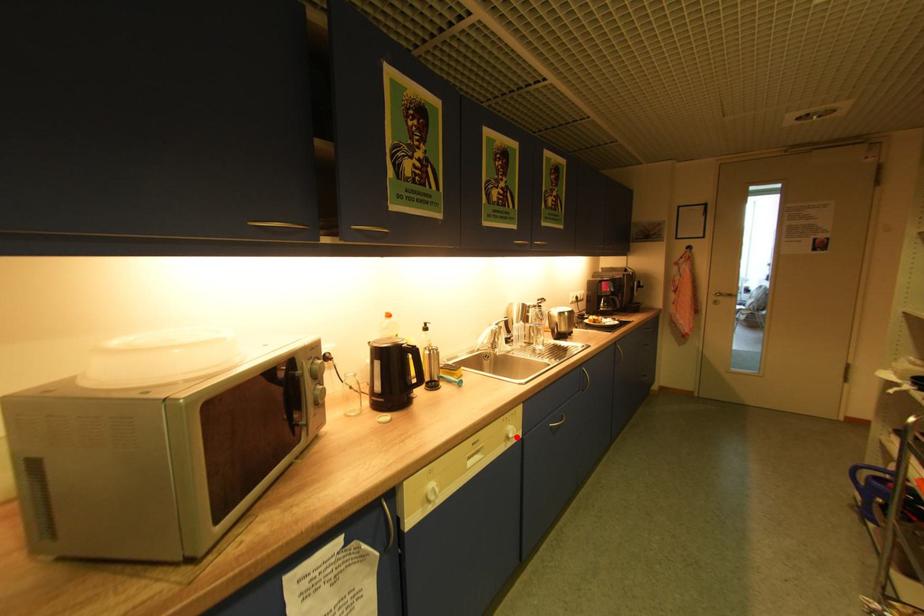
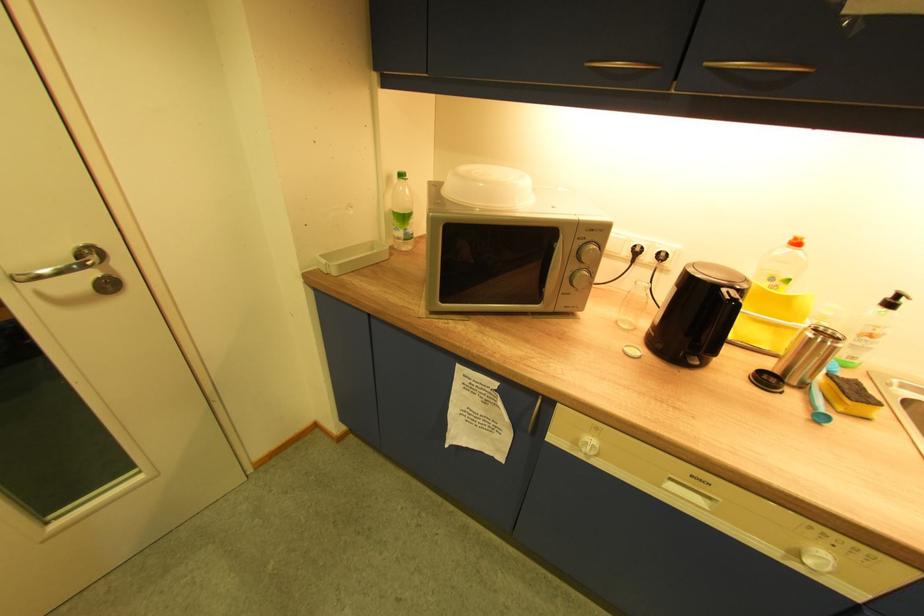
Question: I am providing you with two images of the same scene from different viewpoints. Image1 has a red point marked. In image2, the corresponding 3D location appears at what relative position? Reply with the corresponding letter.

Choices:
 (A) Closer
 (B) Farther

Answer: (A)